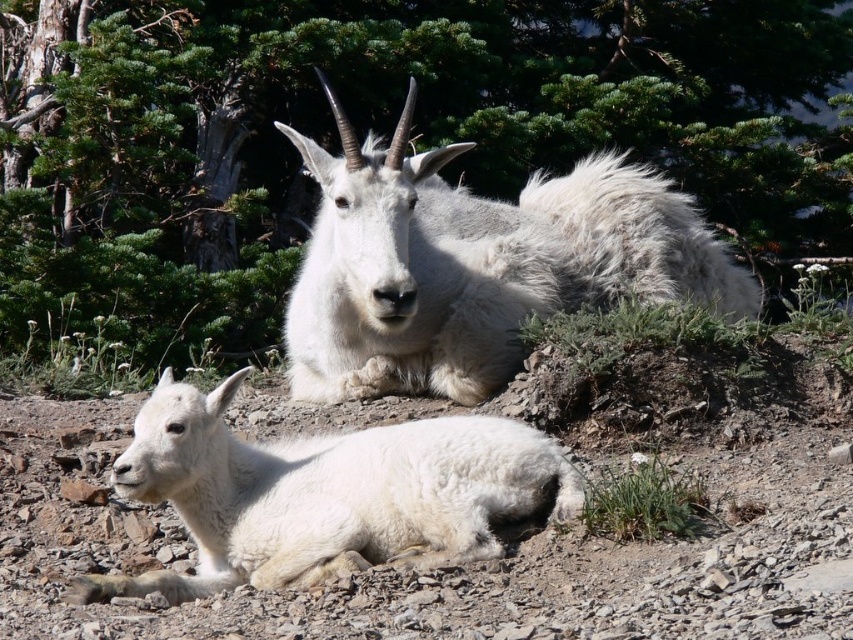
Is green leafy tree at upper center in front of white woolen goat at lower left?

No, it is behind white woolen goat at lower left.

Does point (813, 6) lie in front of point (195, 573)?

No.

Find the location of a particular element. The image size is (853, 640). green leafy tree at upper center is located at coordinates (374, 129).

You are a GUI agent. You are given a task and a screenshot of the screen. Output one action in this format:
    pyautogui.click(x=<x>, y=<y>)
    Task: Click on the green leafy tree at upper center
    The image size is (853, 640).
    Given the screenshot: What is the action you would take?
    pyautogui.click(x=374, y=129)

Is green leafy tree at upper center above white fluffy goat at center?

Indeed, green leafy tree at upper center is positioned over white fluffy goat at center.

Does green leafy tree at upper center appear on the left side of white fluffy goat at center?

Yes, green leafy tree at upper center is to the left of white fluffy goat at center.

Find the location of a particular element. green leafy tree at upper center is located at coordinates (374, 129).

Is white fluffy goat at center smaller than white woolen goat at lower left?

No, white fluffy goat at center is not smaller than white woolen goat at lower left.

From the picture: How far apart are white fluffy goat at center and white woolen goat at lower left?

white fluffy goat at center and white woolen goat at lower left are 38.40 inches apart.

The width and height of the screenshot is (853, 640). What are the coordinates of `white fluffy goat at center` in the screenshot? It's located at [474, 264].